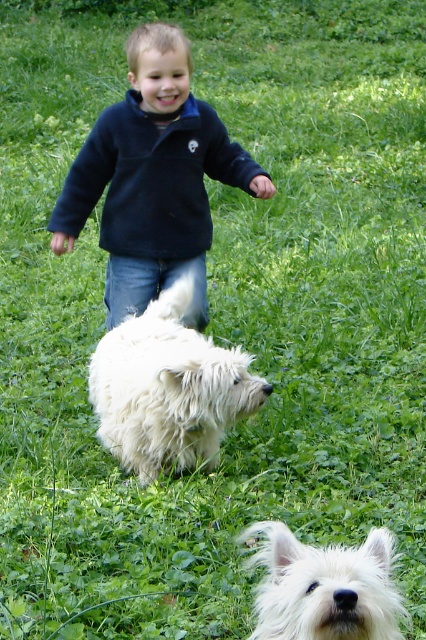
You are a drone operator trying to locate a specific point on the child in the image. The point you need to find is at coordinates point [152,179]. Based on the scene description, where exactly on the child would this point be located?

The point [152,179] is located on the dark blue fleece jacket at center.

You are a photographer trying to capture a photo of the white fluffy dog at center and the dark blue fleece jacket at center. Based on their positions, which object is closer to the left side of the frame?

The white fluffy dog at center is closer to the left side of the frame because the dark blue fleece jacket at center is to the right of it.

You are standing at the position of the camera. The child wearing the dark blue fleece jacket at center is facing forward. If you want to throw a ball to the child so they can catch it without turning around, where should you aim?

You should aim behind the dark blue fleece jacket at center because they are facing forward and the distance between them is 3.92 meters, so throwing behind would allow the child to catch it without turning around.